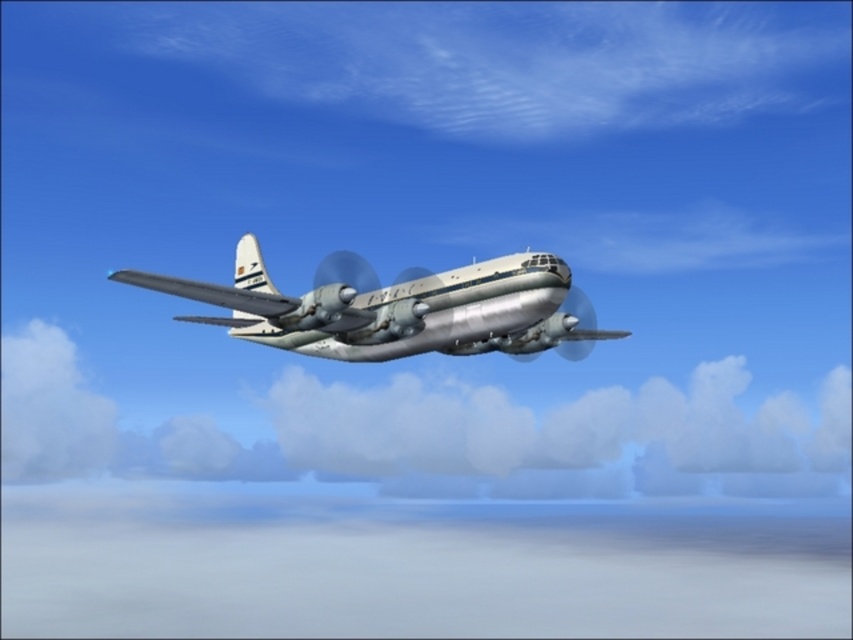
You are a pilot flying the silver metallic airplane at center. You notice a white fluffy cloud at center ahead. Can you see the cloud clearly from your cockpit?

The silver metallic airplane at center is behind the white fluffy cloud at center, so the pilot cannot see the cloud clearly from the cockpit as the airplane is positioned behind it.

You are a pilot flying the silver metallic airplane at center. You want to avoid turbulence caused by the white fluffy cloud at center. Can you safely maneuver around it without getting too close?

The white fluffy cloud at center might be wider than the silver metallic airplane at center, so there might be a risk of turbulence. To avoid it safely, you should consider adjusting your flight path to ensure sufficient distance from the cloud.

Based on the photo, you are a pilot flying the silver metallic airplane at center. You notice a white fluffy cloud at center in your path. Can you safely pass through the cloud without collision?

The white fluffy cloud at center is 104.14 meters away from the silver metallic airplane at center. Since the distance is sufficient, you can safely pass through the cloud without collision.